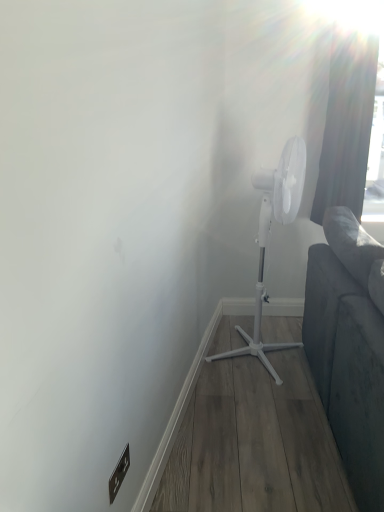
Where is `free point below white plastic mechanical fan at center (from a real-world perspective)`? The height and width of the screenshot is (512, 384). free point below white plastic mechanical fan at center (from a real-world perspective) is located at coordinates (253, 355).